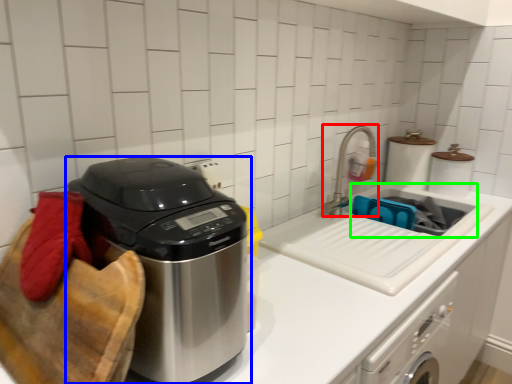
Question: Which object is positioned closest to faucet (highlighted by a red box)? Select from home appliance (highlighted by a blue box) and sink (highlighted by a green box).

Choices:
 (A) home appliance
 (B) sink

Answer: (B)